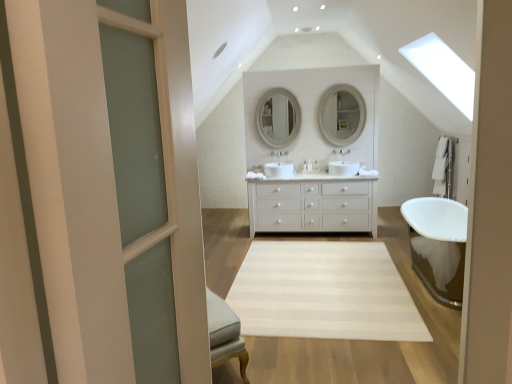
Question: Does white glossy sink at center appear on the left side of matte white mirror at center, positioned as the 2th mirror in right-to-left order?

Choices:
 (A) no
 (B) yes

Answer: (A)

Question: From a real-world perspective, is white glossy sink at center below matte white mirror at center, positioned as the 2th mirror in right-to-left order?

Choices:
 (A) no
 (B) yes

Answer: (B)

Question: Can you confirm if white glossy sink at center is positioned to the right of matte white mirror at center, positioned as the 2th mirror in right-to-left order?

Choices:
 (A) yes
 (B) no

Answer: (A)

Question: Can you confirm if white glossy sink at center is thinner than matte white mirror at center, which is the first mirror from left to right?

Choices:
 (A) yes
 (B) no

Answer: (B)

Question: Is matte white mirror at center, positioned as the 2th mirror in right-to-left order, a part of white glossy sink at center?

Choices:
 (A) no
 (B) yes

Answer: (A)

Question: Is white glossy sink at center bigger than matte white mirror at center, which is the first mirror from left to right?

Choices:
 (A) yes
 (B) no

Answer: (B)

Question: Is white striped rug at center to the right of clear glass door at left from the viewer's perspective?

Choices:
 (A) no
 (B) yes

Answer: (B)

Question: Would you say white striped rug at center is outside clear glass door at left?

Choices:
 (A) yes
 (B) no

Answer: (A)

Question: From a real-world perspective, is white striped rug at center physically above clear glass door at left?

Choices:
 (A) yes
 (B) no

Answer: (B)

Question: Can clear glass door at left be found inside white striped rug at center?

Choices:
 (A) yes
 (B) no

Answer: (B)

Question: From a real-world perspective, does white striped rug at center sit lower than clear glass door at left?

Choices:
 (A) no
 (B) yes

Answer: (B)

Question: From the image's perspective, is white striped rug at center over clear glass door at left?

Choices:
 (A) no
 (B) yes

Answer: (A)

Question: Can you confirm if clear glass door at left is positioned to the right of white ceramic faucet at center?

Choices:
 (A) no
 (B) yes

Answer: (A)